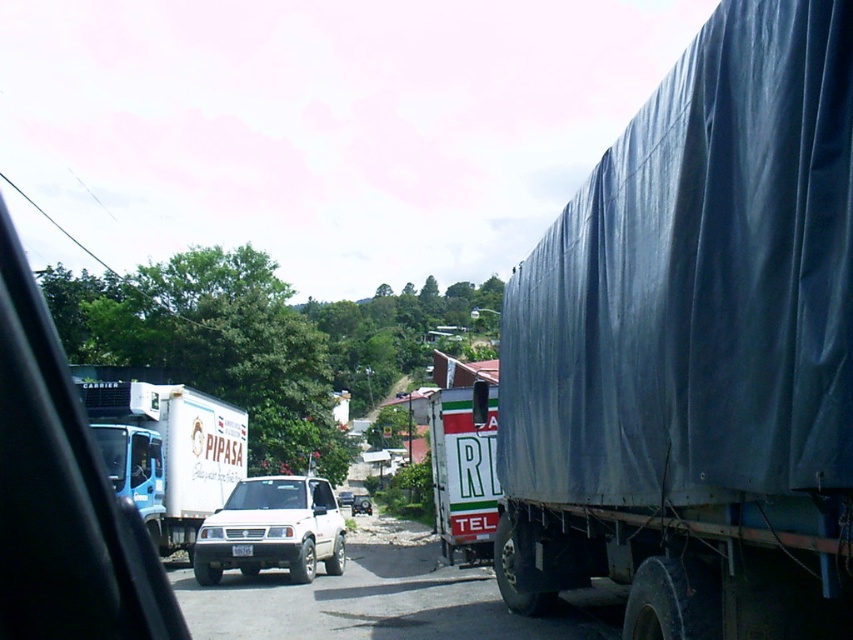
Between point (254, 560) and point (491, 433), which one is positioned behind?

The point (254, 560) is more distant.

Does point (202, 547) come behind point (451, 532)?

Yes, point (202, 547) is behind point (451, 532).

Locate an element on the screen. white matte suv at center is located at coordinates (271, 531).

Locate an element on the screen. The height and width of the screenshot is (640, 853). white matte suv at center is located at coordinates (271, 531).

Who is more distant from viewer, (224, 433) or (434, 435)?

Point (224, 433)

Is white matte truck at left positioned in front of white matte truck at center?

No, it is not.

Is point (152, 518) more distant than point (463, 444)?

That is True.

Image resolution: width=853 pixels, height=640 pixels. What are the coordinates of `white matte truck at left` in the screenshot? It's located at (166, 451).

Which is below, dark gray tarpaulin trailer truck at right or white matte truck at center?

white matte truck at center is lower down.

Is dark gray tarpaulin trailer truck at right shorter than white matte truck at center?

Yes, dark gray tarpaulin trailer truck at right is shorter than white matte truck at center.

Is point (737, 310) more distant than point (494, 493)?

That is False.

The width and height of the screenshot is (853, 640). I want to click on dark gray tarpaulin trailer truck at right, so click(695, 349).